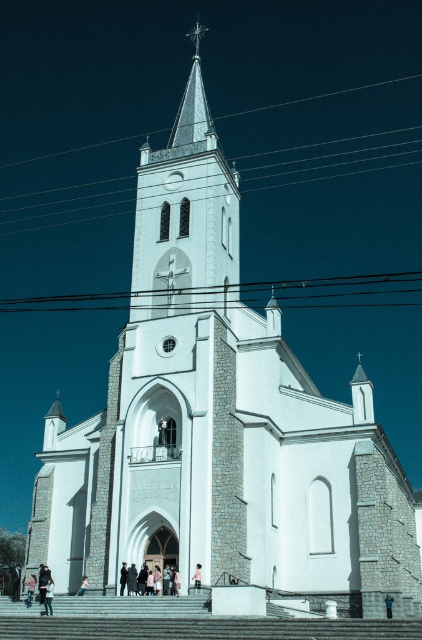
You are standing in front of the white Gothic church and want to determine the spatial relationship between two specific points marked on the church facade. The points are labeled as point 1 at coordinates point (x=124, y=586) and point 2 at coordinates point (x=391, y=609). Which point is closer to you?

Point (x=124, y=586) is closer to you because it is further to the viewer than point (x=391, y=609).

You are a tailor who needs to store the dark gray coat at center and the blue denim jacket at center in a narrow closet. Which one should you hang first to ensure both fit?

The dark gray coat at center is thinner than the blue denim jacket at center, so you should hang the blue denim jacket at center first to accommodate its bulkier size before hanging the thinner dark gray coat at center.